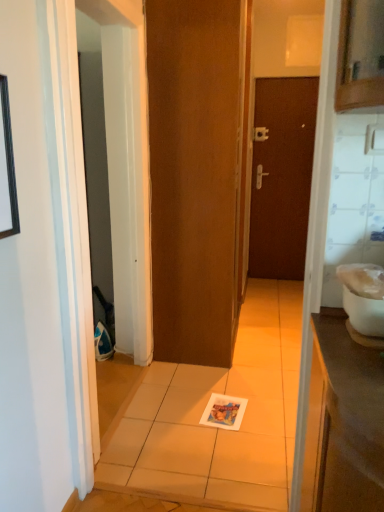
The width and height of the screenshot is (384, 512). I want to click on vacant point above matte paper magazine at center (from a real-world perspective), so click(221, 410).